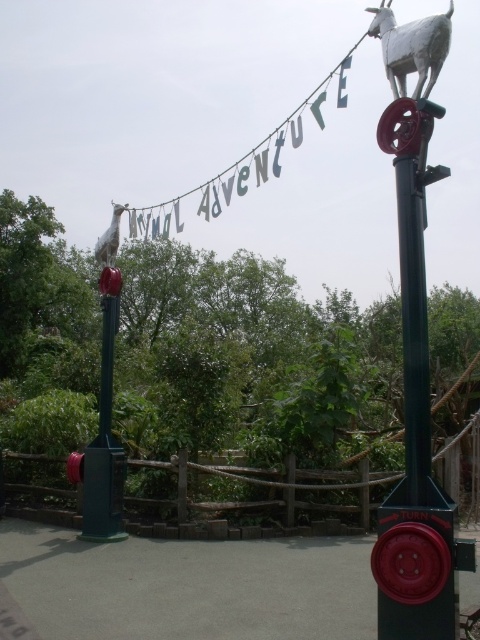
Does metallic red wheel at right appear on the right side of white matte goat at upper left?

Indeed, metallic red wheel at right is positioned on the right side of white matte goat at upper left.

Who is more distant from viewer, (422, 372) or (97, 248)?

Positioned behind is point (97, 248).

The image size is (480, 640). Find the location of `metallic red wheel at right`. metallic red wheel at right is located at coordinates (415, 419).

Locate an element on the screen. The width and height of the screenshot is (480, 640). green matte post at center is located at coordinates (105, 435).

Is green matte post at center below white matte goat at upper left?

Correct, green matte post at center is located below white matte goat at upper left.

You are a GUI agent. You are given a task and a screenshot of the screen. Output one action in this format:
    pyautogui.click(x=<x>, y=<y>)
    Task: Click on the green matte post at center
    The width and height of the screenshot is (480, 640).
    Given the screenshot: What is the action you would take?
    point(105,435)

Which is above, metallic red wheel at right or white matte goat at upper center?

white matte goat at upper center is higher up.

Does metallic red wheel at right have a greater height compared to white matte goat at upper center?

No, metallic red wheel at right is not taller than white matte goat at upper center.

Is point (410, 401) more distant than point (384, 48)?

No, it is not.

Where is `metallic red wheel at right`? The image size is (480, 640). metallic red wheel at right is located at coordinates (415, 419).